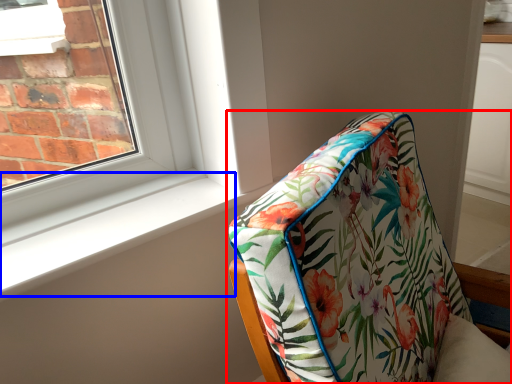
Question: Among these objects, which one is nearest to the camera, furniture (highlighted by a red box) or window sill (highlighted by a blue box)?

Choices:
 (A) furniture
 (B) window sill

Answer: (A)